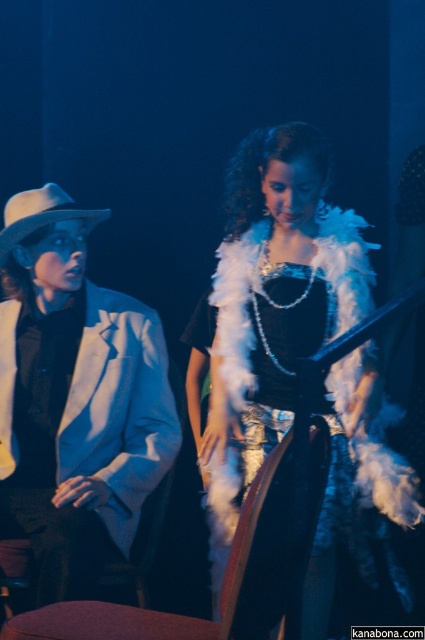
Question: Which point appears farthest from the camera in this image?

Choices:
 (A) (57, 541)
 (B) (11, 248)
 (C) (291, 552)

Answer: (B)

Question: In this image, where is velvet cushioned chair at center located relative to white felt cowboy hat at left?

Choices:
 (A) below
 (B) above

Answer: (A)

Question: Which object appears closest to the camera in this image?

Choices:
 (A) velvet cushioned chair at center
 (B) white fluffy dress at center

Answer: (A)

Question: Which point is closer to the camera?

Choices:
 (A) (363, 493)
 (B) (11, 218)

Answer: (A)

Question: Is velvet cushioned chair at center positioned at the back of white felt cowboy hat at left?

Choices:
 (A) no
 (B) yes

Answer: (A)

Question: Does white fluffy dress at center lie behind white matte jacket at left?

Choices:
 (A) yes
 (B) no

Answer: (B)